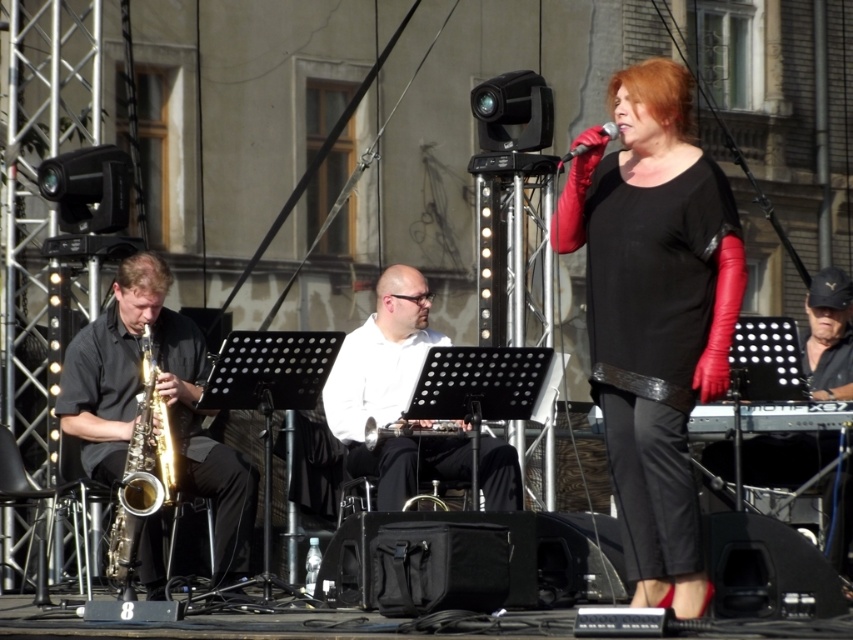
The height and width of the screenshot is (640, 853). I want to click on white smooth shirt at center, so click(x=390, y=392).

How far apart are white smooth shirt at center and black matte microphone at center?

white smooth shirt at center and black matte microphone at center are 4.20 meters apart from each other.

Who is more distant from viewer, (483,452) or (611,129)?

Positioned behind is point (483,452).

Locate an element on the screen. white smooth shirt at center is located at coordinates (390, 392).

Can you confirm if gold shiny saxophone at left is shorter than black matte microphone at center?

Incorrect, gold shiny saxophone at left's height does not fall short of black matte microphone at center's.

I want to click on gold shiny saxophone at left, so click(x=142, y=472).

Can you confirm if white smooth shirt at center is wider than gold shiny saxophone at left?

Correct, the width of white smooth shirt at center exceeds that of gold shiny saxophone at left.

Who is positioned more to the right, white smooth shirt at center or gold shiny saxophone at left?

white smooth shirt at center

The height and width of the screenshot is (640, 853). In order to click on white smooth shirt at center in this screenshot , I will do `click(390, 392)`.

The image size is (853, 640). Find the location of `white smooth shirt at center`. white smooth shirt at center is located at coordinates (390, 392).